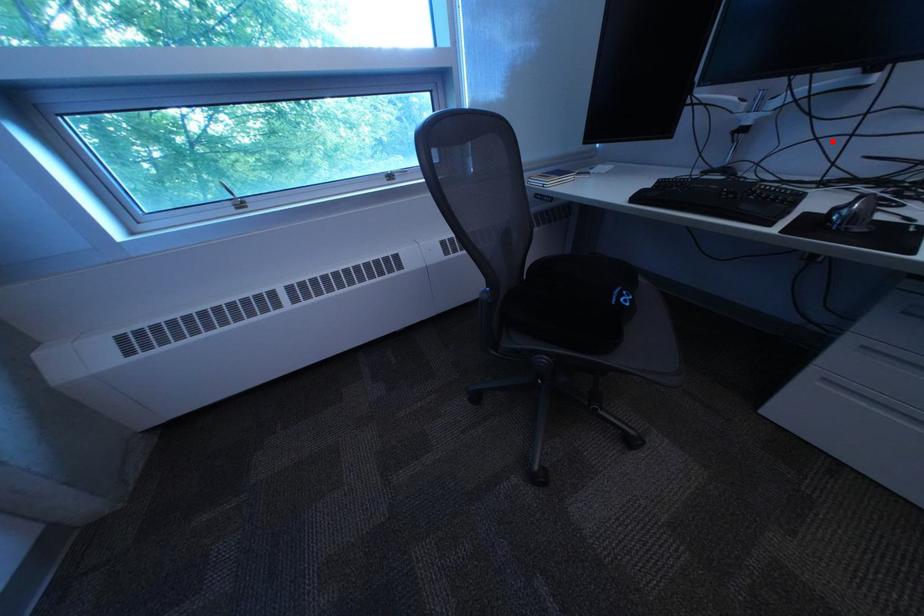
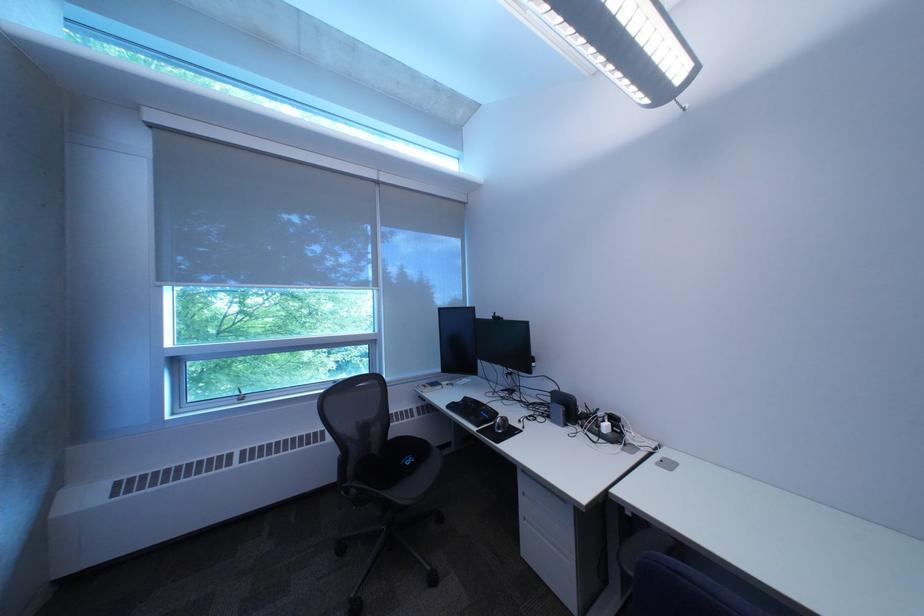
Question: I am providing you with two images of the same scene from different viewpoints. A red point is marked on the first image. Is the red point's position out of view in image 2?

Choices:
 (A) Yes
 (B) No

Answer: (B)